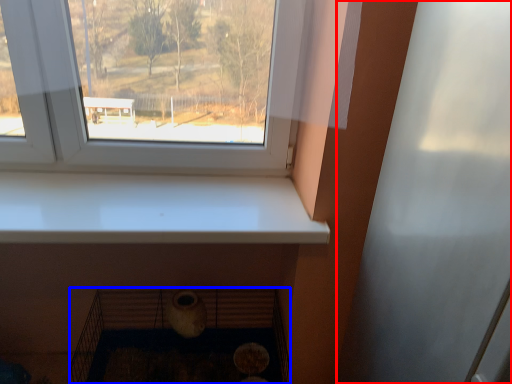
Question: Which of the following is the farthest to the observer, screen door (highlighted by a red box) or shelf (highlighted by a blue box)?

Choices:
 (A) screen door
 (B) shelf

Answer: (B)